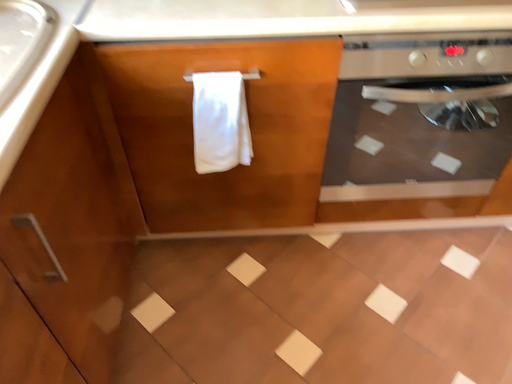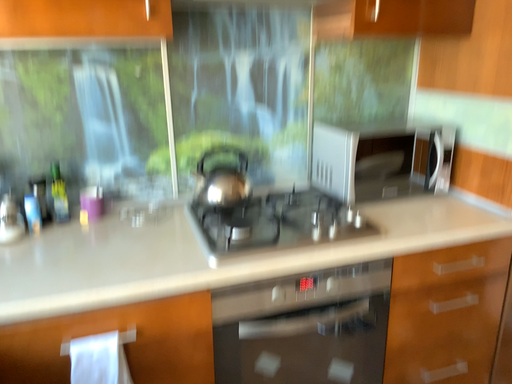
Question: Which way did the camera rotate in the video?

Choices:
 (A) rotated upward
 (B) rotated downward

Answer: (A)